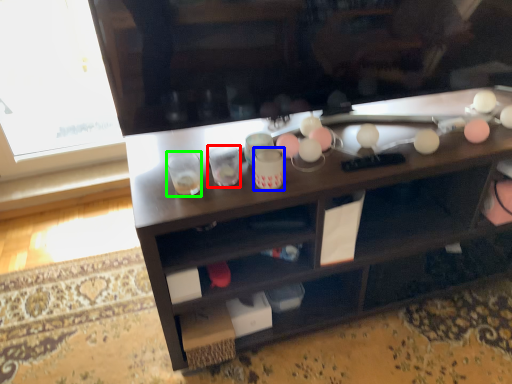
Question: Which is nearer to the shot glass (highlighted by a red box)? beverage (highlighted by a blue box) or shot glass (highlighted by a green box).

Choices:
 (A) beverage
 (B) shot glass

Answer: (B)